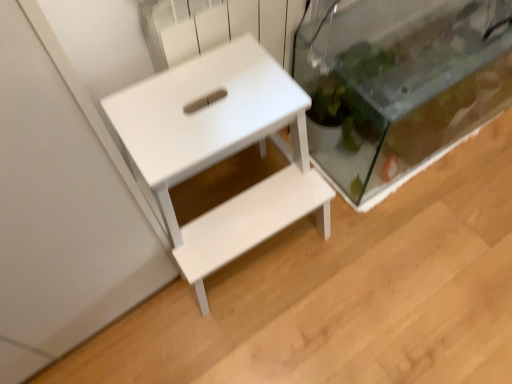
The width and height of the screenshot is (512, 384). In order to click on free point above white matte table at center (from a real-world perspective) in this screenshot , I will do `click(212, 102)`.